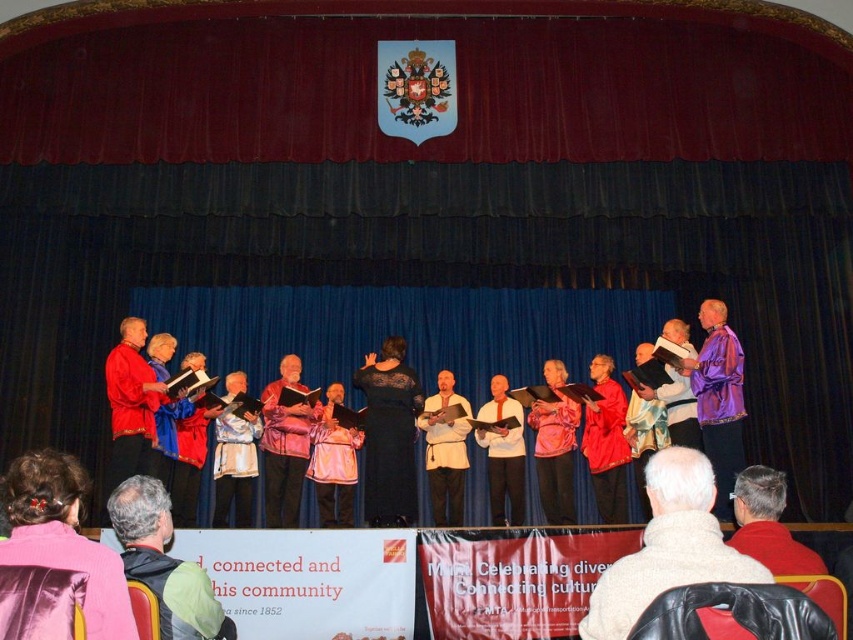
Can you confirm if light brown leather jacket at lower left is positioned below leather jacket at lower right?

Yes.

Does light brown leather jacket at lower left have a lesser width compared to leather jacket at lower right?

No, light brown leather jacket at lower left is not thinner than leather jacket at lower right.

The width and height of the screenshot is (853, 640). I want to click on light brown leather jacket at lower left, so click(x=164, y=563).

Find the location of a particular element. This screenshot has width=853, height=640. light brown leather jacket at lower left is located at coordinates (164, 563).

Is point (88, 556) closer to viewer compared to point (234, 636)?

Yes, point (88, 556) is in front of point (234, 636).

Which is in front, point (21, 500) or point (172, 580)?

Point (21, 500) is in front.

Where is `satin pink jacket at lower left`? This screenshot has height=640, width=853. satin pink jacket at lower left is located at coordinates (64, 538).

Between light brown leather jacket at lower left and black lace dress at center, which one has less height?

light brown leather jacket at lower left is shorter.

Which is in front, point (163, 522) or point (403, 356)?

Positioned in front is point (163, 522).

Does point (144, 572) come closer to viewer compared to point (416, 404)?

Yes, it is.

Find the location of `light brown leather jacket at lower left`. light brown leather jacket at lower left is located at coordinates click(164, 563).